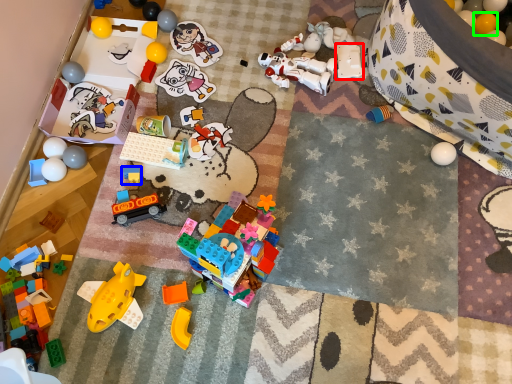
Question: Estimate the real-world distances between objects in this image. Which object is closer to toy (highlighted by a red box), toy (highlighted by a blue box) or toy (highlighted by a green box)?

Choices:
 (A) toy
 (B) toy

Answer: (B)